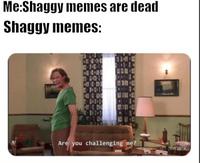
Find the location of a particular element. lamp is located at coordinates (139, 105).